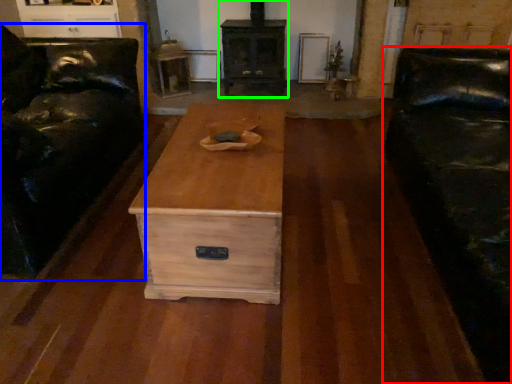
Question: Considering the real-world distances, which object is farthest from studio couch (highlighted by a red box)? furniture (highlighted by a blue box) or fireplace (highlighted by a green box)?

Choices:
 (A) furniture
 (B) fireplace

Answer: (A)